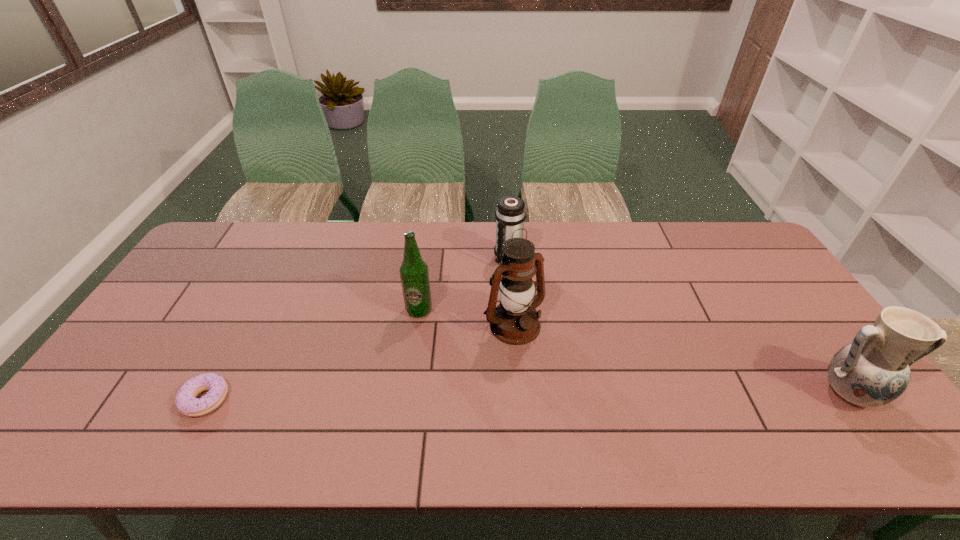
You are a GUI agent. You are given a task and a screenshot of the screen. Output one action in this format:
    pyautogui.click(x=<x>, y=<y>)
    Task: Click on the free region located 0.130m on the side with the handle of the fourth tallest object
    
    Given the screenshot: What is the action you would take?
    pyautogui.click(x=491, y=295)

Identify the location of free space located 0.270m on the label of the beer bottle. This screenshot has height=540, width=960. (469, 387).

This screenshot has width=960, height=540. I want to click on free location located 0.120m on the label of the beer bottle, so click(443, 347).

You are a GUI agent. You are given a task and a screenshot of the screen. Output one action in this format:
    pyautogui.click(x=<x>, y=<y>)
    Task: Click on the vacant space located on the label of the beer bottle
    
    Given the screenshot: What is the action you would take?
    pyautogui.click(x=442, y=344)

Where is `vacant position located on the side of the tallest object, there is a wick adjustment knob`? This screenshot has width=960, height=540. vacant position located on the side of the tallest object, there is a wick adjustment knob is located at coordinates (584, 412).

This screenshot has width=960, height=540. Identify the location of free spot located on the side of the tallest object, there is a wick adjustment knob. (573, 399).

This screenshot has height=540, width=960. What are the coordinates of `free space located 0.170m on the side of the tallest object, there is a wick adjustment knob` in the screenshot? It's located at (566, 390).

This screenshot has width=960, height=540. I want to click on object that is at the far edge, so [x=510, y=215].

Where is `doughnut located at the near edge`? doughnut located at the near edge is located at coordinates (186, 402).

Locate an element on the screen. pottery positioned at the near edge is located at coordinates (873, 370).